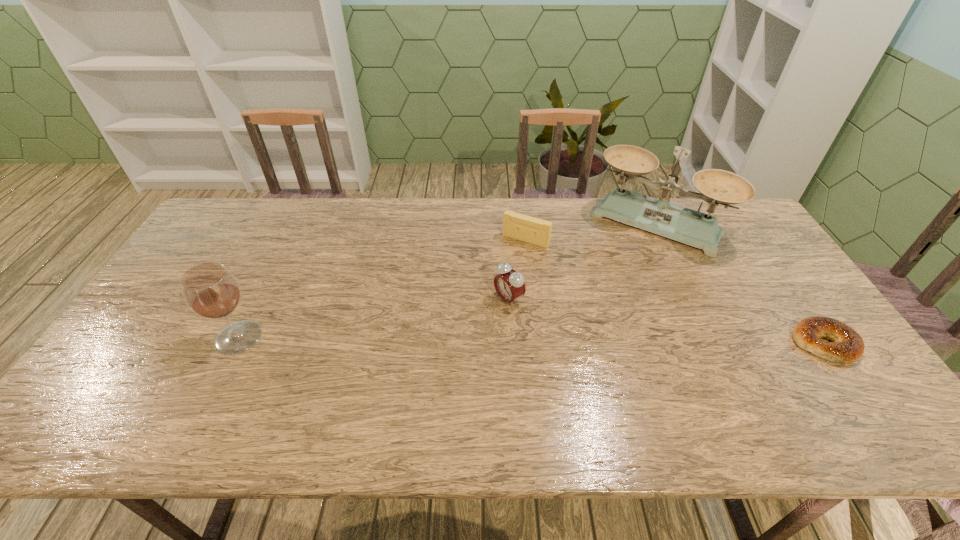
Identify the location of vacant space on the desktop that is between the wineglass and the bagel and is positioned at the front of the videotape with spools. (465, 340).

Find the location of a particular element. The height and width of the screenshot is (540, 960). free space on the desktop that is between the fourth shortest object and the shortest object and is positioned on the front-facing side of the tallest object is located at coordinates (590, 341).

Locate an element on the screen. vacant spot on the desktop that is between the wineglass and the bagel and is positioned on the clock face of the alarm clock is located at coordinates [x=443, y=340].